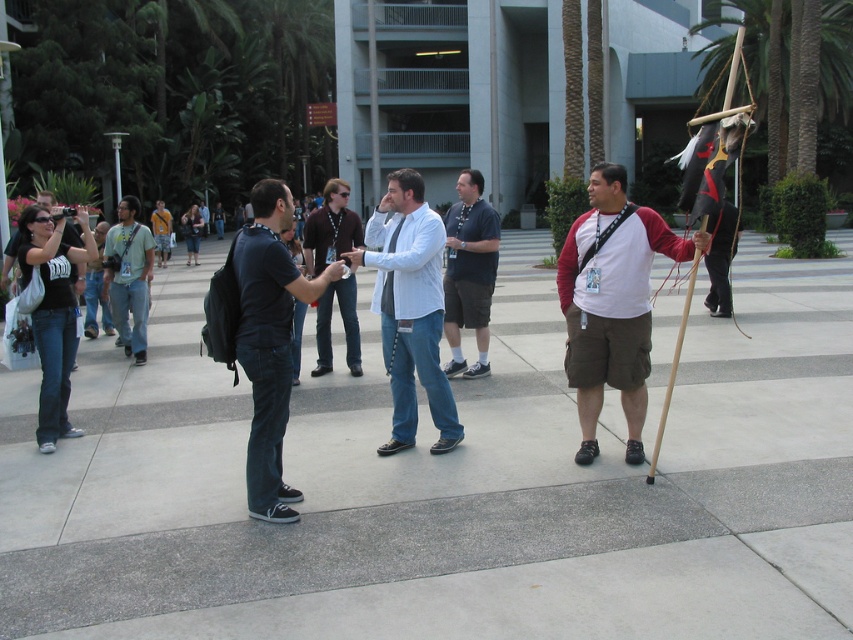
Question: Can you confirm if matte white shirt at center is positioned below yellow t-shirt at center?

Choices:
 (A) yes
 (B) no

Answer: (A)

Question: Considering the real-world distances, which object is closest to the yellow t-shirt at center?

Choices:
 (A) dark blue jeans at center
 (B) white matte shirt at center
 (C) dark blue t-shirt at center

Answer: (C)

Question: Which object is positioned closest to the dark blue jeans at center?

Choices:
 (A) dark blue t-shirt at center
 (B) matte black backpack at left
 (C) yellow t-shirt at center

Answer: (A)

Question: Estimate the real-world distances between objects in this image. Which object is farther from the dark blue jeans at center?

Choices:
 (A) dark blue t-shirt at center
 (B) white shirt at center

Answer: (B)

Question: Is white shirt at center below matte black backpack at left?

Choices:
 (A) yes
 (B) no

Answer: (B)

Question: Can you confirm if white matte shirt at center is positioned above white shirt at center?

Choices:
 (A) no
 (B) yes

Answer: (A)